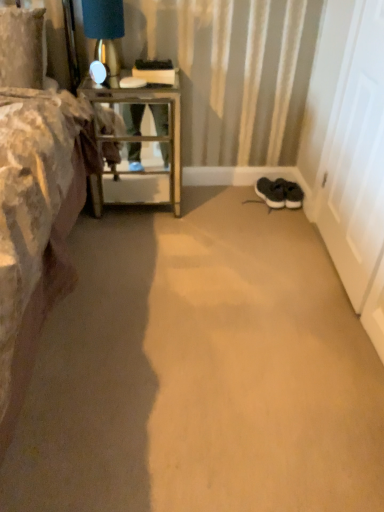
At what (x,y) coordinates should I click in order to perform the action: click on free space on the front side of black suede sneakers at lower right. Please return your answer as a coordinate pair (x, y). This screenshot has height=512, width=384. Looking at the image, I should click on (276, 213).